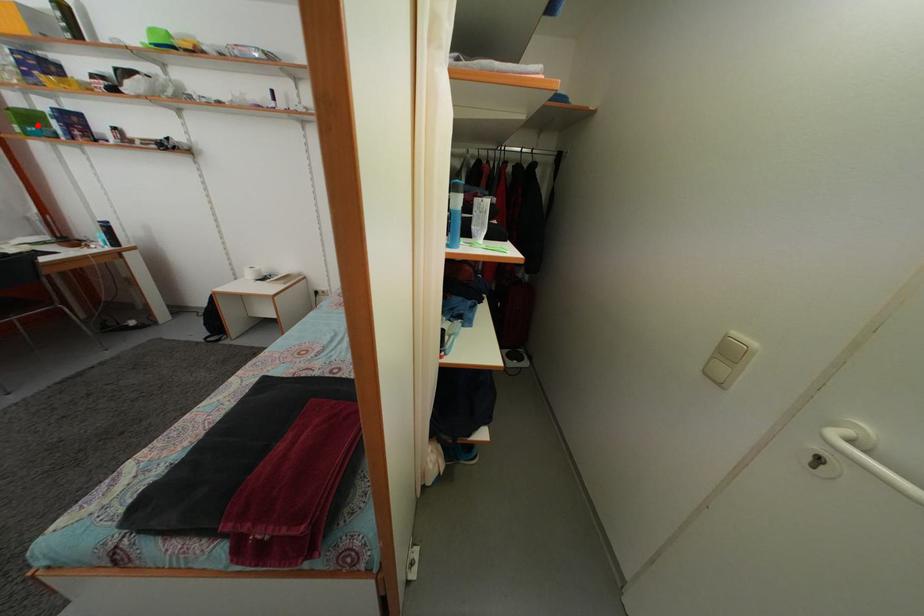
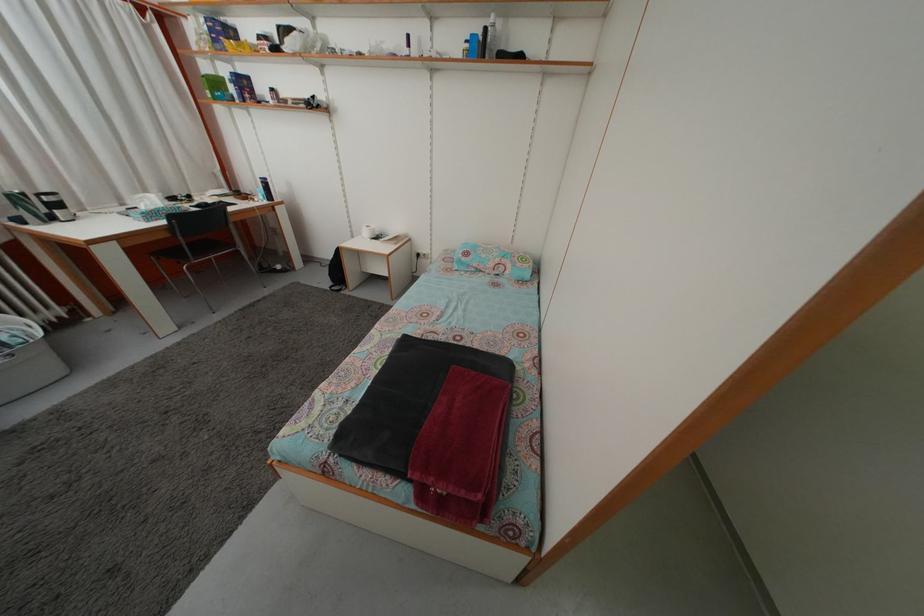
The point at the highlighted location is marked in the first image. Where is the corresponding point in the second image?

(223, 91)